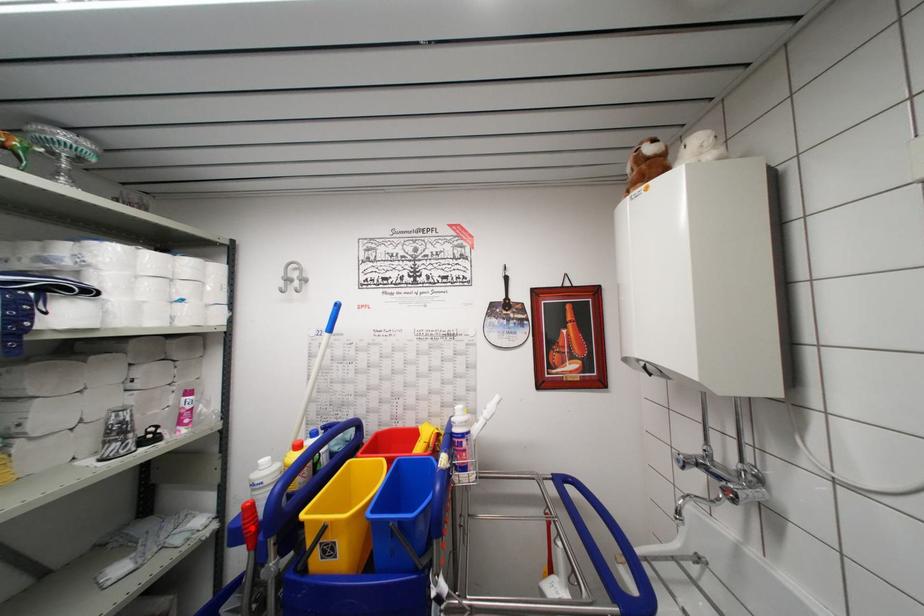
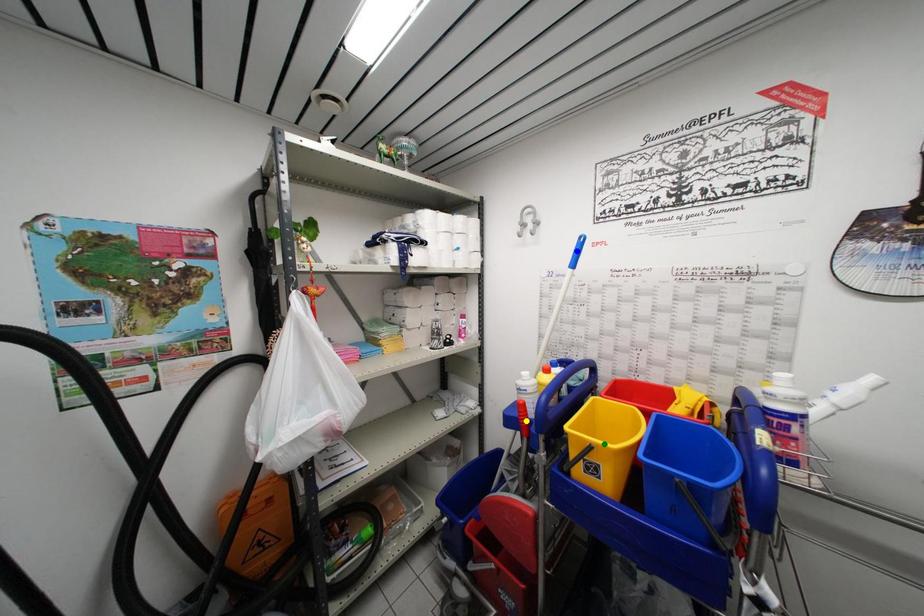
Question: I am providing you with two images of the same scene from different viewpoints. A red point is marked on the first image. You are given multiple points on the second image. In image 2, which mark is for the same physical point as the one in image 1?

Choices:
 (A) green point
 (B) yellow point
 (C) blue point

Answer: (B)